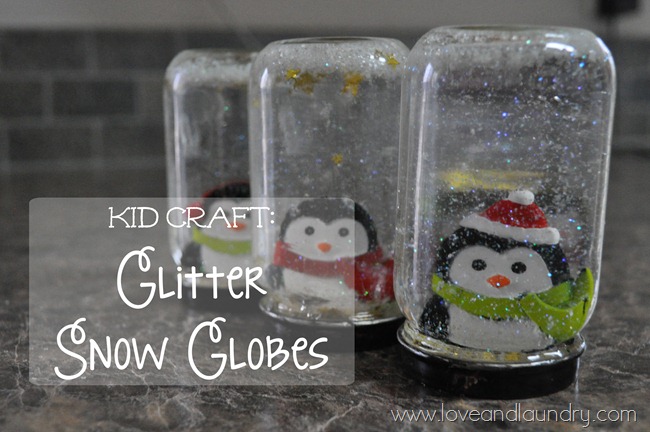
You are a GUI agent. You are given a task and a screenshot of the screen. Output one action in this format:
    pyautogui.click(x=<x>, y=<y>)
    Task: Click on the jar lids
    
    Given the screenshot: What is the action you would take?
    pyautogui.click(x=428, y=373), pyautogui.click(x=374, y=335), pyautogui.click(x=221, y=303)